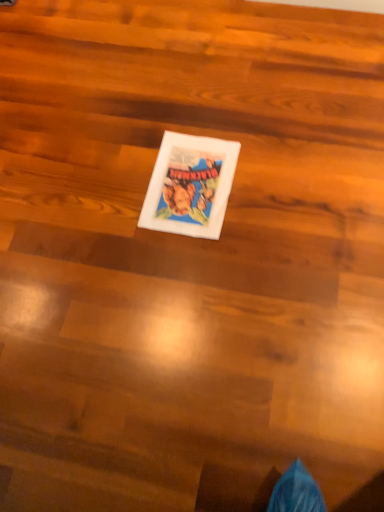
I want to click on unoccupied space behind white matte comic book at center, so click(x=178, y=111).